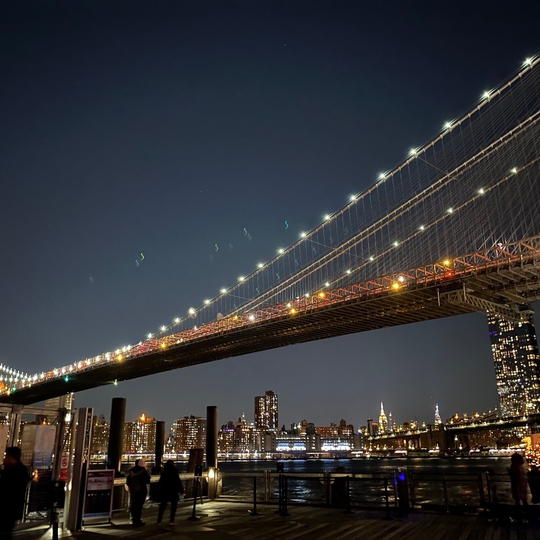
I want to click on beam, so click(60, 414).